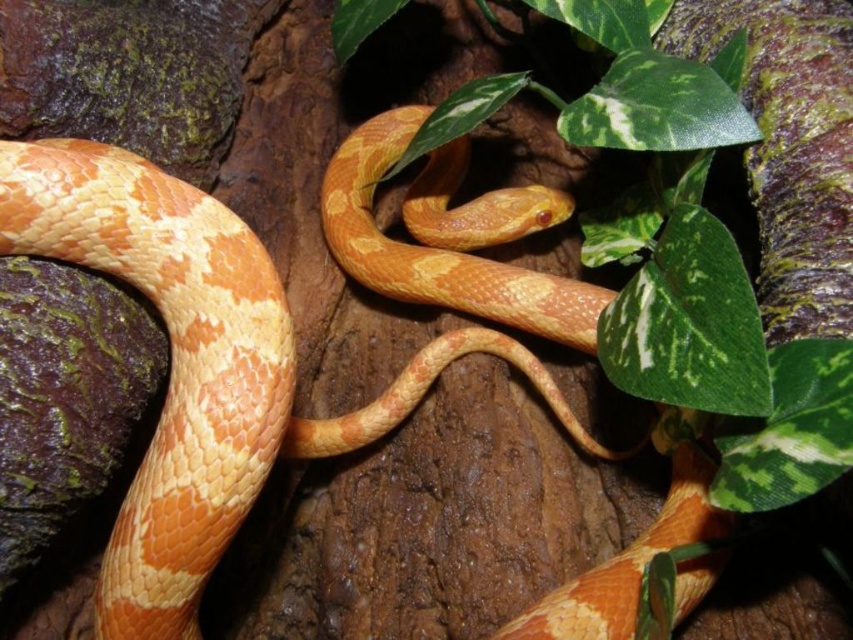
You are a photographer aiming to capture the orange scaly snake at center and the green leafy plant at upper center in a single frame. Based on their positions, which object should you adjust your camera to focus on first to ensure both are in the shot?

The orange scaly snake at center is to the left of the green leafy plant at upper center. Since the snake is positioned to the left, you should focus on the green leafy plant at upper center first to ensure both are within the frame.

You are an animal researcher observing the orange scaly snake at center in a controlled environment. The snake is at coordinates 0.572, 0.236. If you need to place a heat lamp directly above it, where should you position the heat lamp in terms of coordinates?

To place the heat lamp directly above the orange scaly snake at center located at coordinates (x=200, y=365), you should position it at the same x coordinate, 0.572, but adjust the y coordinate to a higher value, such as 0.236 plus the desired distance, ensuring it is above the snake.

Based on the photo, you are observing a snake coiled around a tree trunk in the image. There are two points marked on the snake, one at coordinates point (216, 536) and the other at point (843, 129). Which point is positioned closer to your viewpoint?

Point (216, 536) is closer to the viewer than point (843, 129).